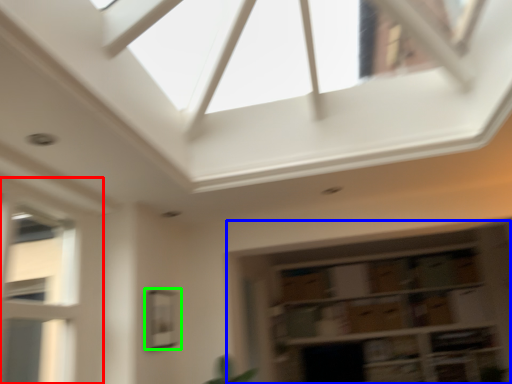
Question: Considering the real-world distances, which object is closest to window (highlighted by a red box)? shelf (highlighted by a blue box) or window (highlighted by a green box).

Choices:
 (A) shelf
 (B) window

Answer: (B)